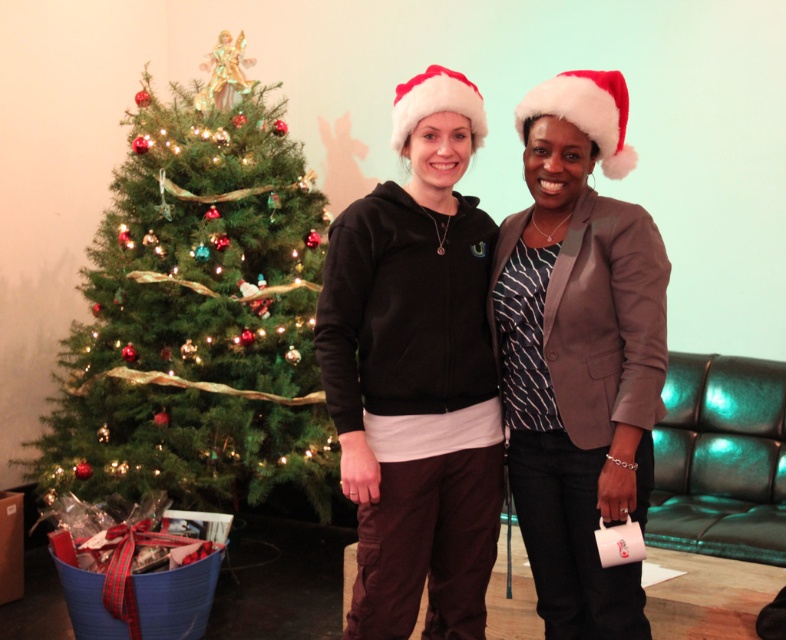
Question: Is black soft hoodie at center to the left of red velvet santa hat at upper center from the viewer's perspective?

Choices:
 (A) no
 (B) yes

Answer: (B)

Question: Which point is closer to the camera taking this photo?

Choices:
 (A) (652, 328)
 (B) (568, 72)
 (C) (64, 390)

Answer: (A)

Question: Can you confirm if green textured christmas tree at left is wider than black soft hoodie at center?

Choices:
 (A) yes
 (B) no

Answer: (A)

Question: Among these objects, which one is farthest from the camera?

Choices:
 (A) red velvet santa hat at upper center
 (B) green textured christmas tree at left

Answer: (B)

Question: Observing the image, what is the correct spatial positioning of black soft hoodie at center in reference to red velvet santa hat at upper center?

Choices:
 (A) above
 (B) below

Answer: (B)

Question: Which object is farther from the camera taking this photo?

Choices:
 (A) red velvet santa hat at upper center
 (B) black soft hoodie at center

Answer: (A)